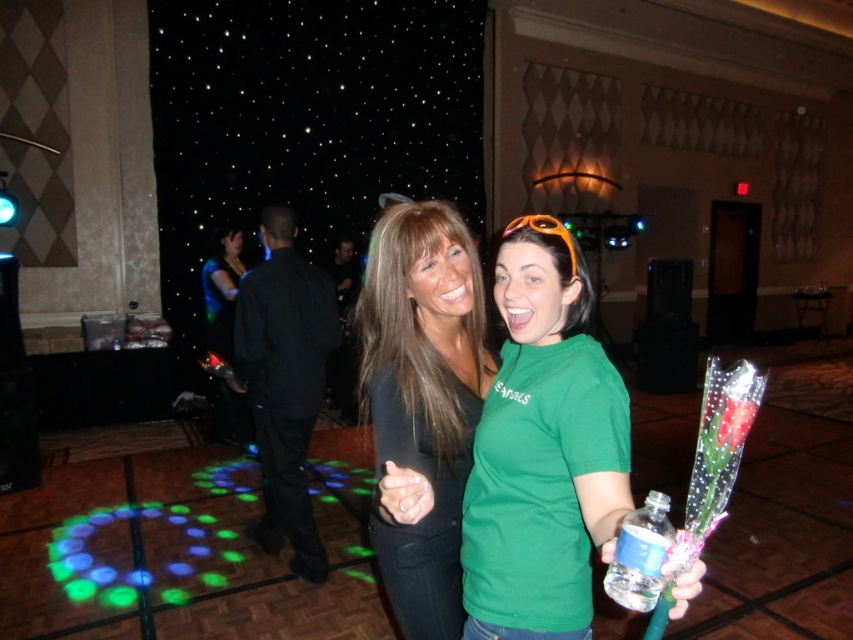
You are at the party and need to decide which item is wider between the green matte shirt at center and the clear plastic bottle at lower right. Which one is wider?

Result: The green matte shirt at center is wider than the clear plastic bottle at lower right according to the description.

You are at a party and want to give the bouquet of red roses to the person wearing the matte black top at center. Which direction should you move relative to the green matte shirt at center to reach them?

The green matte shirt at center is positioned on the right side of the matte black top at center. To reach the matte black top at center, you should move to the left side of the green matte shirt at center.